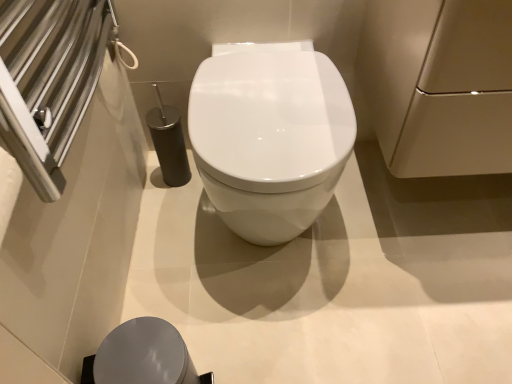
Question: Is there a large distance between white glossy toilet at center and matte beige cabinet at upper right?

Choices:
 (A) no
 (B) yes

Answer: (A)

Question: From the image's perspective, is white glossy toilet at center on top of matte beige cabinet at upper right?

Choices:
 (A) no
 (B) yes

Answer: (A)

Question: Can you confirm if white glossy toilet at center is smaller than matte beige cabinet at upper right?

Choices:
 (A) no
 (B) yes

Answer: (A)

Question: Can you confirm if white glossy toilet at center is positioned to the right of matte beige cabinet at upper right?

Choices:
 (A) yes
 (B) no

Answer: (B)

Question: Is white glossy toilet at center oriented towards matte beige cabinet at upper right?

Choices:
 (A) no
 (B) yes

Answer: (A)

Question: From the image's perspective, relative to white glossy toilet at center, is matte gray lid at lower center above or below?

Choices:
 (A) below
 (B) above

Answer: (A)

Question: Is matte gray lid at lower center taller or shorter than white glossy toilet at center?

Choices:
 (A) tall
 (B) short

Answer: (B)

Question: In terms of size, does matte gray lid at lower center appear bigger or smaller than white glossy toilet at center?

Choices:
 (A) small
 (B) big

Answer: (A)

Question: From a real-world perspective, relative to white glossy toilet at center, is matte gray lid at lower center vertically above or below?

Choices:
 (A) below
 (B) above

Answer: (A)

Question: Based on their positions, is matte gray lid at lower center located to the left or right of matte beige cabinet at upper right?

Choices:
 (A) right
 (B) left

Answer: (B)

Question: Considering the positions of matte gray lid at lower center and matte beige cabinet at upper right in the image, is matte gray lid at lower center wider or thinner than matte beige cabinet at upper right?

Choices:
 (A) thin
 (B) wide

Answer: (A)

Question: Is point (144, 370) closer or farther from the camera than point (406, 71)?

Choices:
 (A) farther
 (B) closer

Answer: (B)

Question: In the image, is matte gray lid at lower center positioned in front of or behind matte beige cabinet at upper right?

Choices:
 (A) behind
 (B) front

Answer: (A)

Question: From the image's perspective, is matte beige cabinet at upper right above or below white glossy toilet at center?

Choices:
 (A) below
 (B) above

Answer: (B)

Question: Is matte beige cabinet at upper right in front of or behind white glossy toilet at center in the image?

Choices:
 (A) front
 (B) behind

Answer: (A)